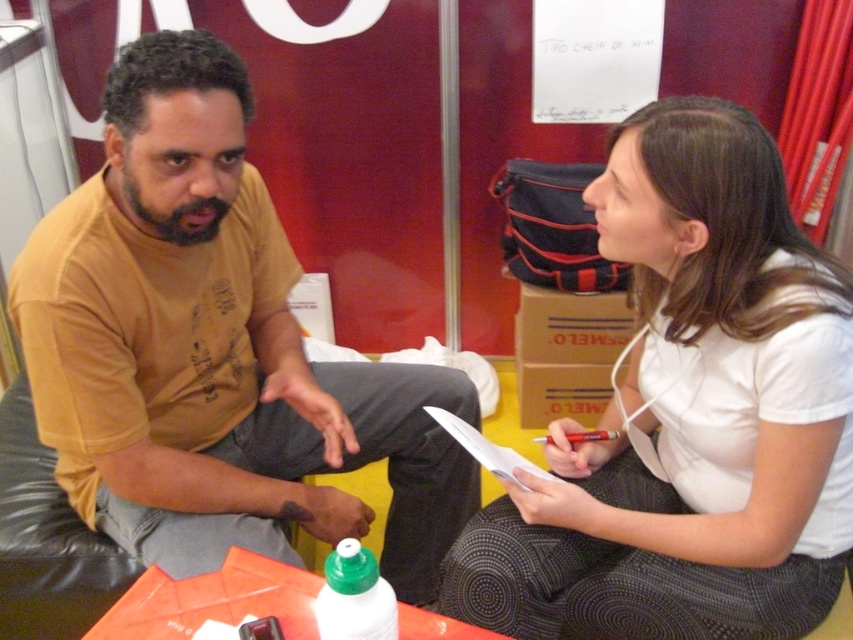
Question: Can you confirm if white matte shirt at center is bigger than green matte bottle at center?

Choices:
 (A) yes
 (B) no

Answer: (A)

Question: Among these objects, which one is nearest to the camera?

Choices:
 (A) white matte shirt at center
 (B) green matte bottle at center

Answer: (B)

Question: Based on their relative distances, which object is nearer to the white matte shirt at center?

Choices:
 (A) green matte bottle at center
 (B) matte yellow t-shirt at left

Answer: (B)

Question: Does matte yellow t-shirt at left have a lesser width compared to white matte shirt at center?

Choices:
 (A) no
 (B) yes

Answer: (A)

Question: Which object is the closest to the matte yellow t-shirt at left?

Choices:
 (A) white matte shirt at center
 (B) green matte bottle at center

Answer: (A)

Question: Is matte yellow t-shirt at left to the left of green matte bottle at center from the viewer's perspective?

Choices:
 (A) no
 (B) yes

Answer: (B)